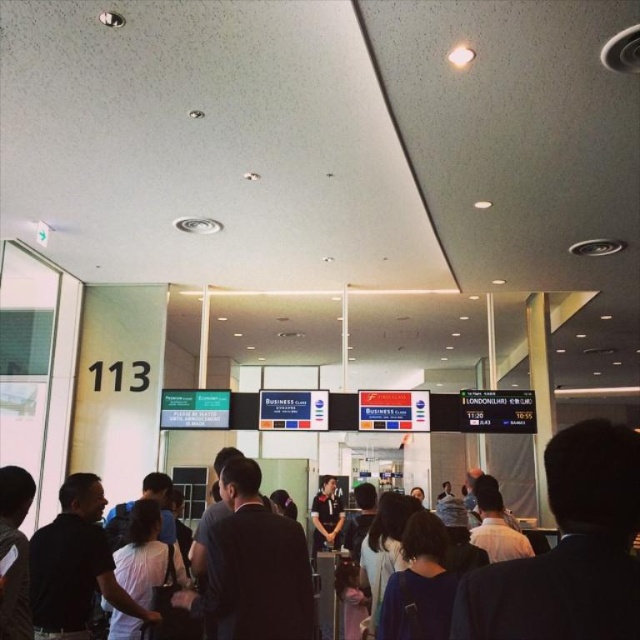
You are standing in the airport terminal and want to reach a specific point marked at coordinates point (628, 572). Considering your height is 170 cm, will you be able to see over the crowd of travelers in front of you to that point?

The distance to the point (628, 572) is 96.24 centimeters from the viewer. Since this distance is very short, you are likely able to see over the crowd of travelers in front of you to that point as the crowd is only 96.24 centimeters away.

You are a traveler trying to locate your companion who is wearing a dark blue shirt at center. You are currently standing near the dark blue suit at right. Can you see your companion directly from your current position?

The dark blue suit at right is positioned over dark blue shirt at center, so the dark blue suit at right is blocking your view of the dark blue shirt at center. You cannot see your companion directly from your current position.